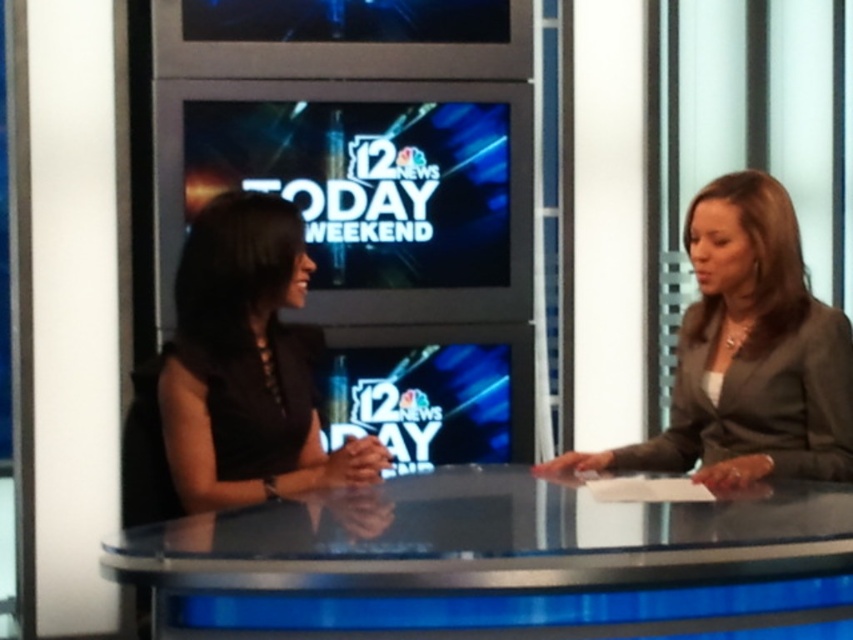
Between point (624, 620) and point (701, 264), which one is positioned behind?

The point (701, 264) is more distant.

Who is more distant from viewer, (x=151, y=532) or (x=763, y=307)?

The point (x=763, y=307) is behind.

Image resolution: width=853 pixels, height=640 pixels. Find the location of `transparent glass table at center`. transparent glass table at center is located at coordinates (489, 563).

Describe the element at coordinates (747, 355) in the screenshot. I see `dark gray suit at right` at that location.

Who is more distant from viewer, [831,369] or [369,449]?

Positioned behind is point [831,369].

Is point (751, 337) closer to viewer compared to point (231, 241)?

No, (751, 337) is further to viewer.

Where is `dark gray suit at right`? The width and height of the screenshot is (853, 640). dark gray suit at right is located at coordinates (747, 355).

Which is behind, point (698, 566) or point (299, 483)?

The point (299, 483) is behind.

Does transparent glass table at center have a greater height compared to black matte dress at center?

Incorrect, transparent glass table at center's height is not larger of black matte dress at center's.

Which is behind, point (207, 604) or point (236, 196)?

Positioned behind is point (236, 196).

This screenshot has height=640, width=853. I want to click on transparent glass table at center, so click(x=489, y=563).